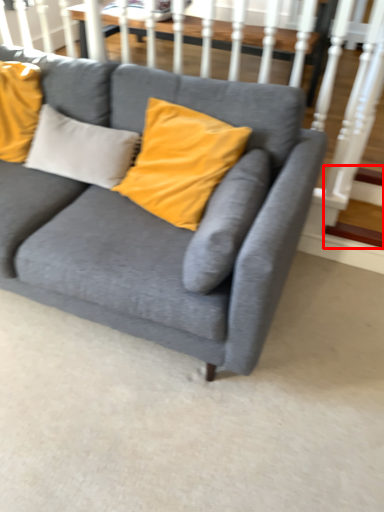
Question: From the image, what is the correct spatial relationship of stairs (annotated by the red box) in relation to studio couch?

Choices:
 (A) left
 (B) right

Answer: (B)